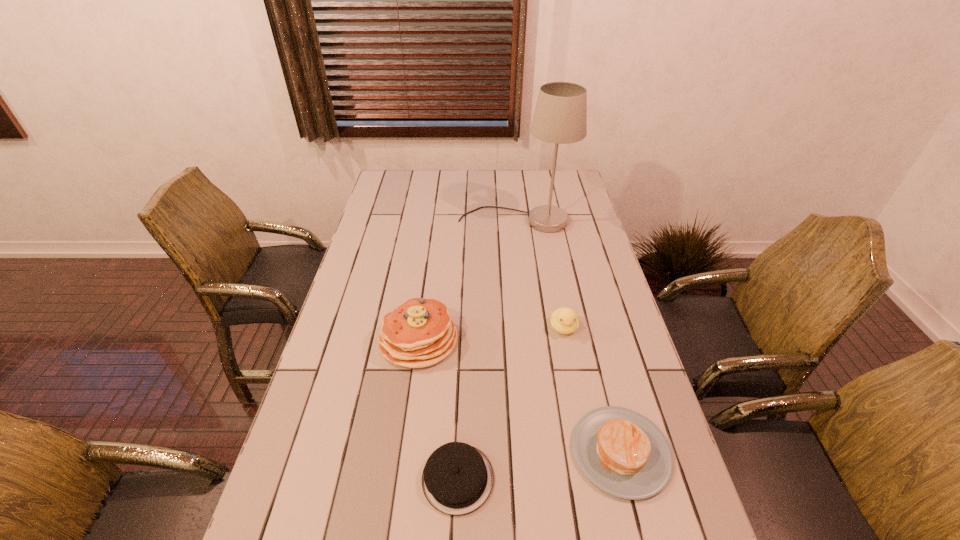
You are a GUI agent. You are given a task and a screenshot of the screen. Output one action in this format:
    pyautogui.click(x=<x>, y=<y>)
    Task: Click on the free spot between the second tallest pancake and the duckling
    The height and width of the screenshot is (540, 960).
    Given the screenshot: What is the action you would take?
    pyautogui.click(x=592, y=389)

Locate an element on the screen. empty space that is in between the farthest object and the fourth shortest object is located at coordinates (467, 280).

Where is `vacant area that lies between the farthest pancake and the shortest pancake`? vacant area that lies between the farthest pancake and the shortest pancake is located at coordinates (438, 409).

The image size is (960, 540). Find the location of `vacant space that's between the farthest object and the fourth shortest object`. vacant space that's between the farthest object and the fourth shortest object is located at coordinates (467, 280).

At what (x,y) coordinates should I click in order to perform the action: click on free area in between the duckling and the second tallest object. Please return your answer as a coordinate pair (x, y). Looking at the image, I should click on (491, 334).

This screenshot has width=960, height=540. What are the coordinates of `vacant area that lies between the shortest pancake and the second tallest object` in the screenshot? It's located at (438, 409).

Image resolution: width=960 pixels, height=540 pixels. I want to click on free space between the duckling and the tallest object, so click(x=540, y=274).

You are a GUI agent. You are given a task and a screenshot of the screen. Output one action in this format:
    pyautogui.click(x=<x>, y=<y>)
    Task: Click on the vacant space that's between the duckling and the shortest pancake
    The height and width of the screenshot is (540, 960).
    Given the screenshot: What is the action you would take?
    pyautogui.click(x=511, y=403)

Find the location of a particular element. The image size is (960, 540). empty space that is in between the duckling and the tallest pancake is located at coordinates (491, 334).

What are the coordinates of `object that is the third nearest to the second tallest object` in the screenshot? It's located at (623, 453).